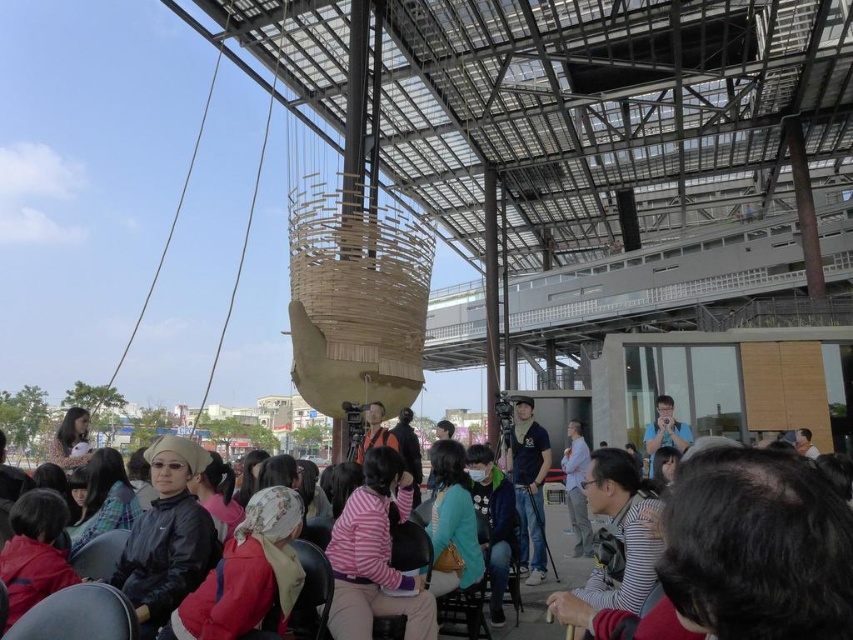
Question: From the image, what is the correct spatial relationship of leather-like black chair at lower left in relation to light blue shirt at center?

Choices:
 (A) left
 (B) right

Answer: (A)

Question: Among these points, which one is nearest to the camera?

Choices:
 (A) (538, 628)
 (B) (32, 624)
 (C) (573, 476)
 (D) (537, 493)

Answer: (B)

Question: Does denim jacket at center have a larger size compared to matte black chair at lower left?

Choices:
 (A) no
 (B) yes

Answer: (B)

Question: Which of the following is the closest to the observer?

Choices:
 (A) (80, 630)
 (B) (564, 588)
 (C) (660, 429)
 (D) (577, 465)

Answer: (A)

Question: Which point is farther to the camera?

Choices:
 (A) (99, 625)
 (B) (538, 557)

Answer: (B)

Question: Can you confirm if pink striped sweater at center is smaller than light blue shirt at center?

Choices:
 (A) no
 (B) yes

Answer: (A)